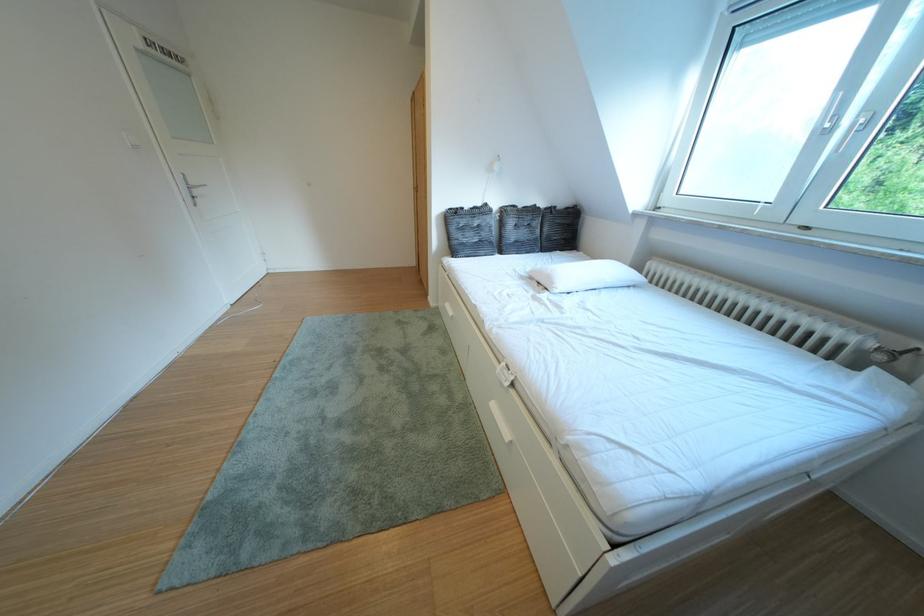
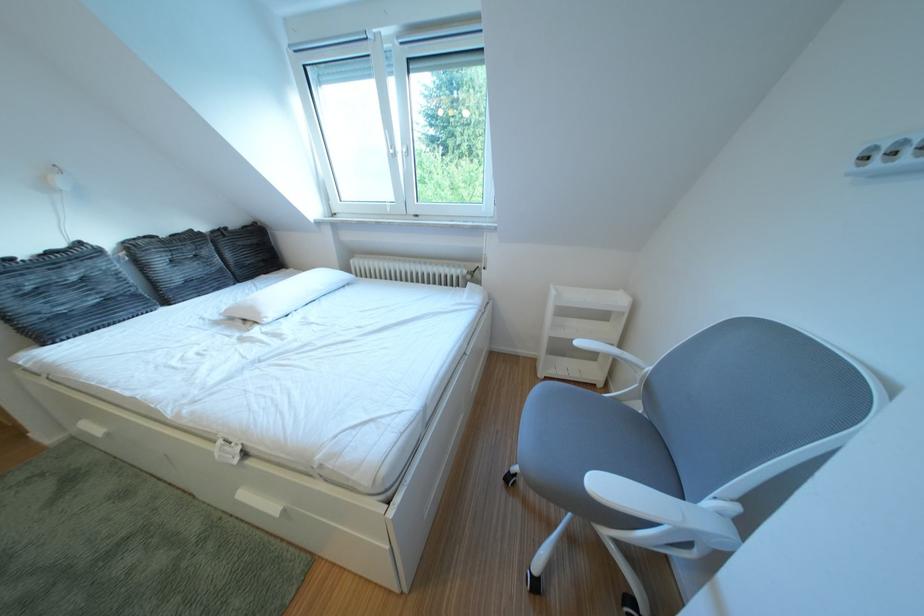
Question: The images are taken continuously from a first-person perspective. In which direction is your viewpoint rotating?

Choices:
 (A) Left
 (B) Right
 (C) Up
 (D) Down

Answer: (B)